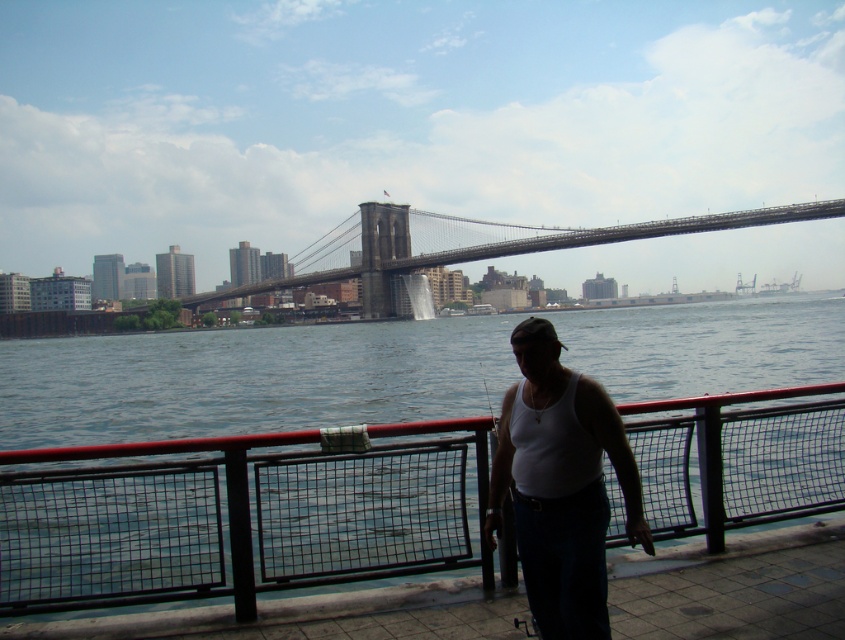
Question: Which point appears closest to the camera in this image?

Choices:
 (A) (837, 384)
 (B) (404, 209)

Answer: (A)

Question: Can you confirm if white cotton tank top at center is wider than metallic gray bridge at center?

Choices:
 (A) no
 (B) yes

Answer: (A)

Question: Estimate the real-world distances between objects in this image. Which object is closer to the black metal fence at lower center?

Choices:
 (A) white cotton tank top at center
 (B) metallic gray bridge at center

Answer: (A)

Question: Among these points, which one is farthest from the camera?

Choices:
 (A) (513, 340)
 (B) (116, 484)

Answer: (B)

Question: Is white cotton tank top at center positioned at the back of metallic gray bridge at center?

Choices:
 (A) yes
 (B) no

Answer: (B)

Question: Does black metal fence at lower center appear on the left side of white cotton tank top at center?

Choices:
 (A) no
 (B) yes

Answer: (B)